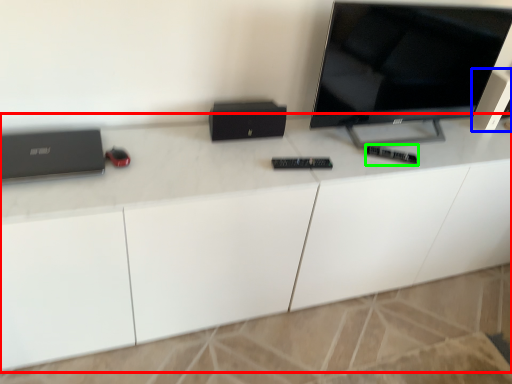
Question: Which is nearer to the desk (highlighted by a red box)? speaker (highlighted by a blue box) or control (highlighted by a green box).

Choices:
 (A) speaker
 (B) control

Answer: (B)